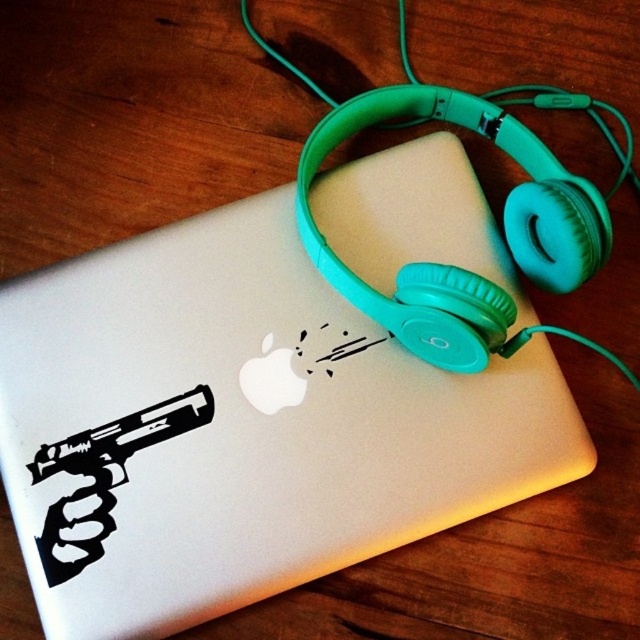
Question: In this image, where is white matte laptop at center located relative to black vinyl sticker at lower left?

Choices:
 (A) left
 (B) right

Answer: (B)

Question: Which point is closer to the camera?

Choices:
 (A) (x=156, y=272)
 (B) (x=52, y=554)

Answer: (B)

Question: Does white matte laptop at center appear under black vinyl sticker at lower left?

Choices:
 (A) no
 (B) yes

Answer: (A)

Question: Is white matte laptop at center further to the viewer compared to black vinyl sticker at lower left?

Choices:
 (A) no
 (B) yes

Answer: (A)